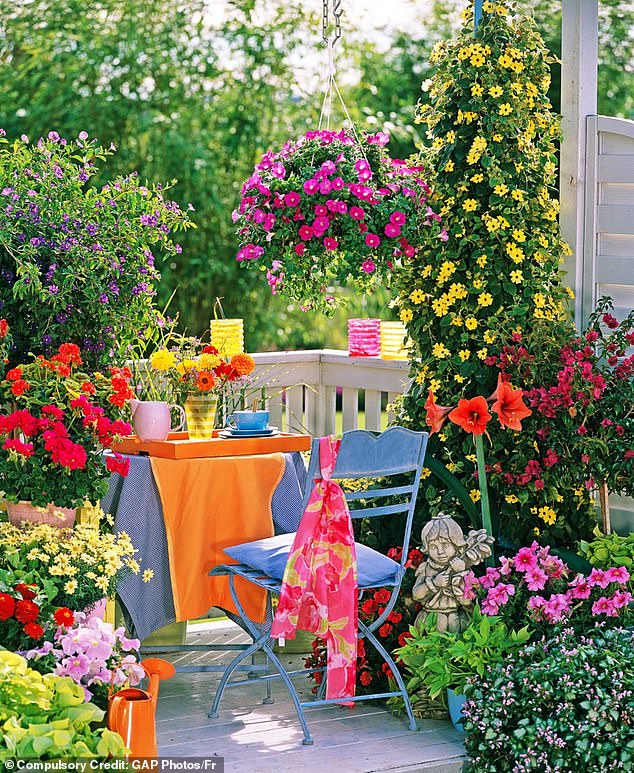
Locate an element on the screen. Image resolution: width=634 pixels, height=773 pixels. vase is located at coordinates (200, 409), (399, 342), (363, 341), (229, 338).